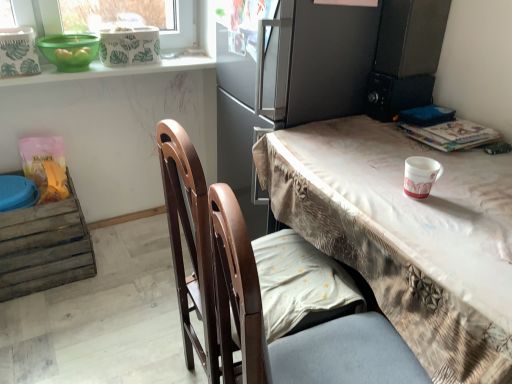
Question: Considering the positions of green plastic bowl at upper left and matte gray fridge at upper center in the image, is green plastic bowl at upper left taller or shorter than matte gray fridge at upper center?

Choices:
 (A) tall
 (B) short

Answer: (B)

Question: In the image, is green plastic bowl at upper left positioned in front of or behind matte gray fridge at upper center?

Choices:
 (A) front
 (B) behind

Answer: (B)

Question: Considering the real-world distances, which object is closest to the green plastic bowl at upper left?

Choices:
 (A) matte gray fridge at upper center
 (B) brown wooden chair at center
 (C) hardcover book at upper right
 (D) floral-patterned fabric table at right
 (E) weathered wood crate at lower left

Answer: (A)

Question: Which object is the farthest from the brown wooden chair at center?

Choices:
 (A) white paper cup at right
 (B) green plastic bowl at upper left
 (C) matte gray fridge at upper center
 (D) hardcover book at upper right
 (E) weathered wood crate at lower left

Answer: (B)